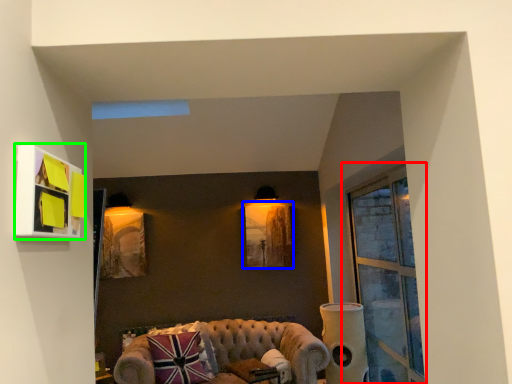
Question: Which object is positioned closest to window (highlighted by a red box)? Select from picture frame (highlighted by a blue box) and picture frame (highlighted by a green box).

Choices:
 (A) picture frame
 (B) picture frame

Answer: (A)